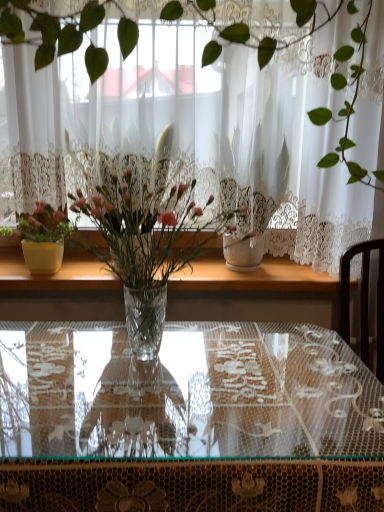
Where is `vacant area situated below clear glass vase at center, which is the 1th houseplant from right to left (from a real-world perspective)`? The width and height of the screenshot is (384, 512). vacant area situated below clear glass vase at center, which is the 1th houseplant from right to left (from a real-world perspective) is located at coordinates (144, 362).